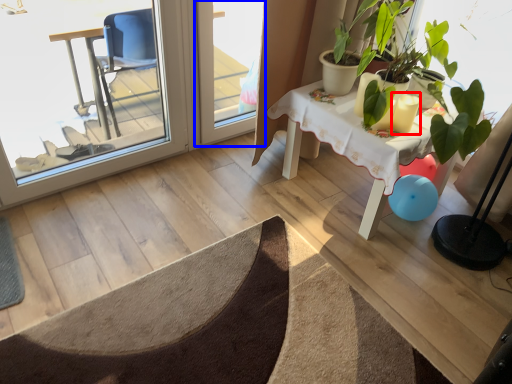
Question: Which object appears farthest to the camera in this image, candle holder (highlighted by a red box) or screen door (highlighted by a blue box)?

Choices:
 (A) candle holder
 (B) screen door

Answer: (B)